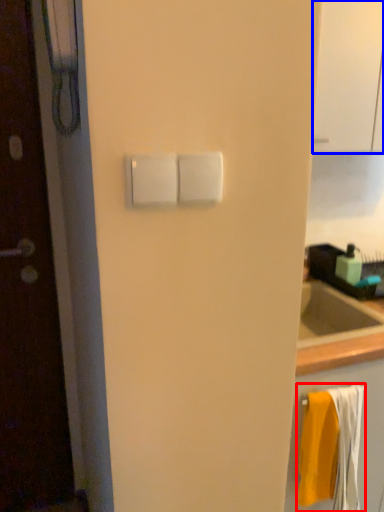
Question: Among these objects, which one is farthest to the camera, bath towel (highlighted by a red box) or glass door (highlighted by a blue box)?

Choices:
 (A) bath towel
 (B) glass door

Answer: (A)